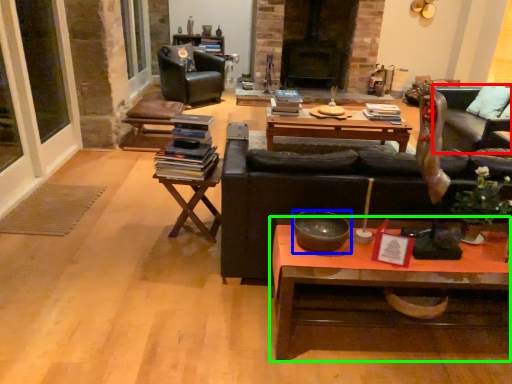
Question: Estimate the real-world distances between objects in this image. Which object is farther from couch (highlighted by a red box), bowl (highlighted by a blue box) or coffee table (highlighted by a green box)?

Choices:
 (A) bowl
 (B) coffee table

Answer: (A)